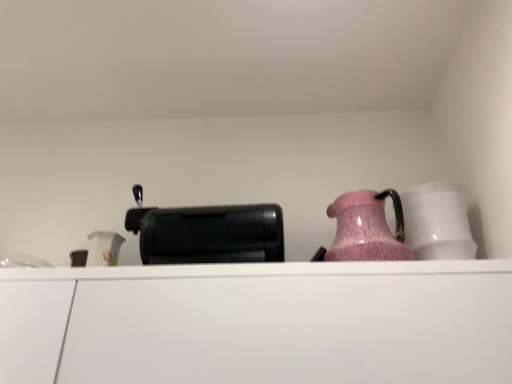
Question: Considering the positions of black plastic toaster at center and white matte cabinet at center in the image, is black plastic toaster at center wider or thinner than white matte cabinet at center?

Choices:
 (A) thin
 (B) wide

Answer: (A)

Question: Is black plastic toaster at center taller or shorter than white matte cabinet at center?

Choices:
 (A) tall
 (B) short

Answer: (B)

Question: Which of these objects is positioned farthest from the white matte cabinet at center?

Choices:
 (A) black plastic toaster at center
 (B) pink glossy jug at upper right
 (C) white glossy mug at right

Answer: (C)

Question: Estimate the real-world distances between objects in this image. Which object is closer to the white matte cabinet at center?

Choices:
 (A) black plastic toaster at center
 (B) white glossy mug at right
 (C) pink glossy jug at upper right

Answer: (A)